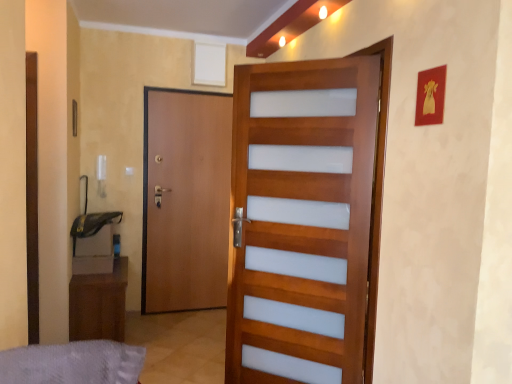
Question: In which direction should I rotate to look at wooden door with frosted panels at center, which appears as the second door when viewed from the back?

Choices:
 (A) left
 (B) right

Answer: (B)

Question: Is wooden door with frosted panels at center, which is the second door from left to right, not close to brown wood door at left, which is the 2th door from front to back?

Choices:
 (A) no
 (B) yes

Answer: (B)

Question: Is wooden door with frosted panels at center, acting as the 1th door starting from the right, further to camera compared to brown wood door at left, which is the 1th door from back to front?

Choices:
 (A) no
 (B) yes

Answer: (A)

Question: Can you confirm if wooden door with frosted panels at center, acting as the 1th door starting from the right, is positioned to the right of brown wood door at left, which is the 1th door from back to front?

Choices:
 (A) no
 (B) yes

Answer: (B)

Question: From a real-world perspective, is wooden door with frosted panels at center, the 1th door in the front-to-back sequence, located beneath brown wood door at left, placed as the 2th door when sorted from right to left?

Choices:
 (A) no
 (B) yes

Answer: (A)

Question: Is wooden door with frosted panels at center, which appears as the second door when viewed from the back, at the left side of brown wood door at left, placed as the 2th door when sorted from right to left?

Choices:
 (A) yes
 (B) no

Answer: (B)

Question: Is wooden door with frosted panels at center, which is the second door from left to right, oriented away from brown wood door at left, which ranks as the first door in left-to-right order?

Choices:
 (A) yes
 (B) no

Answer: (B)

Question: Is wooden door with frosted panels at center, which appears as the second door when viewed from the back, surrounding brown wood cabinet at lower left?

Choices:
 (A) no
 (B) yes

Answer: (A)

Question: Is wooden door with frosted panels at center, the 1th door in the front-to-back sequence, further to the viewer compared to brown wood cabinet at lower left?

Choices:
 (A) no
 (B) yes

Answer: (A)

Question: Is wooden door with frosted panels at center, which is the second door from left to right, to the right of brown wood cabinet at lower left from the viewer's perspective?

Choices:
 (A) no
 (B) yes

Answer: (B)

Question: Is wooden door with frosted panels at center, the 1th door in the front-to-back sequence, not near brown wood cabinet at lower left?

Choices:
 (A) yes
 (B) no

Answer: (A)

Question: Is the position of wooden door with frosted panels at center, which appears as the second door when viewed from the back, less distant than that of brown wood cabinet at lower left?

Choices:
 (A) yes
 (B) no

Answer: (A)

Question: From the image's perspective, would you say wooden door with frosted panels at center, acting as the 1th door starting from the right, is positioned over brown wood cabinet at lower left?

Choices:
 (A) yes
 (B) no

Answer: (A)

Question: From a real-world perspective, does gray fabric bed at lower left sit lower than brown wood door at left, which is the 1th door from back to front?

Choices:
 (A) no
 (B) yes

Answer: (B)